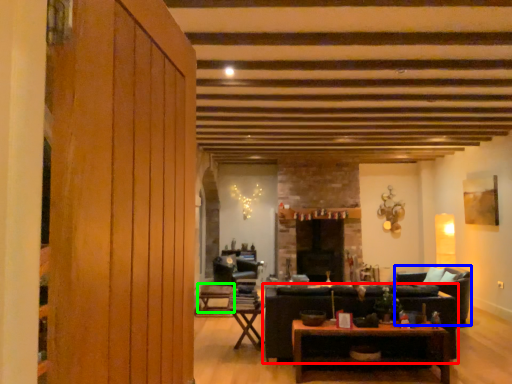
Question: Which is farther away from studio couch (highlighted by a red box)? armchair (highlighted by a blue box) or table (highlighted by a green box)?

Choices:
 (A) armchair
 (B) table

Answer: (B)